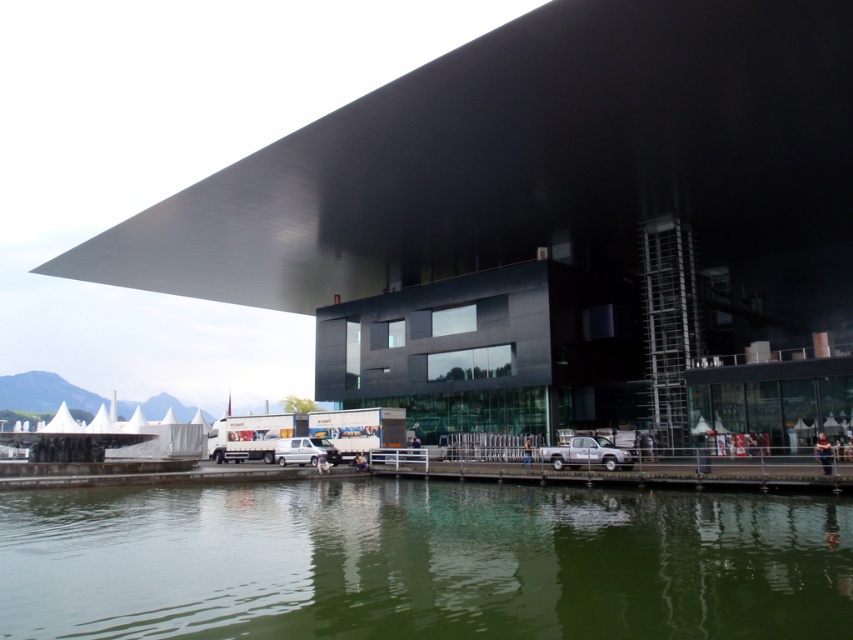
Consider the image. Which is more to the right, green liquid water at lower center or metallic dock at lower center?

Positioned to the right is metallic dock at lower center.

The image size is (853, 640). Describe the element at coordinates (421, 561) in the screenshot. I see `green liquid water at lower center` at that location.

Does point (80, 518) come closer to viewer compared to point (663, 476)?

Yes, point (80, 518) is in front of point (663, 476).

Find the location of a particular element. The image size is (853, 640). green liquid water at lower center is located at coordinates (421, 561).